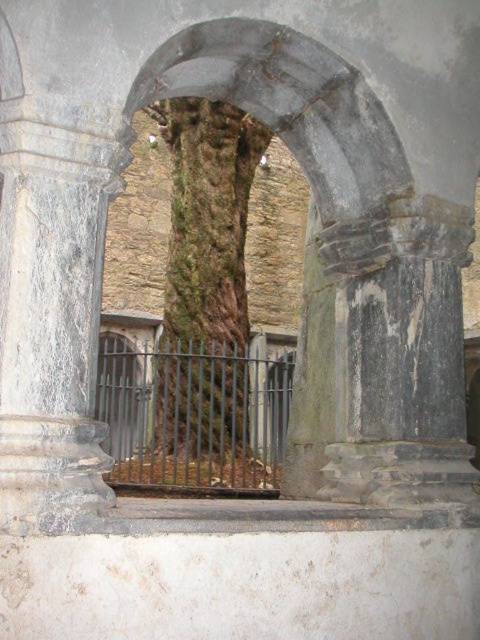
You are standing in front of the historical structure and want to take a photo of the rough stone archway at center. Based on its position, where should you aim your camera to capture it properly?

The rough stone archway at center is located at point (289, 106), so you should aim your camera at those coordinates to capture it properly.

You are a painter standing in front of the rough stone archway at center and the black metal fence at center. Which object should you paint first if you want to start with the larger one?

The rough stone archway at center is bigger than the black metal fence at center, so you should paint the rough stone archway at center first.

You are a painter standing in front of the rough stone archway at center and the black metal fence at center. You want to paint both, but your canvas is only 1 meter wide. Which object should you focus on to ensure it fits entirely on the canvas?

The rough stone archway at center is wider than the black metal fence at center. Since the canvas is 1 meter wide, you should focus on painting the black metal fence at center to ensure it fits entirely on the canvas.